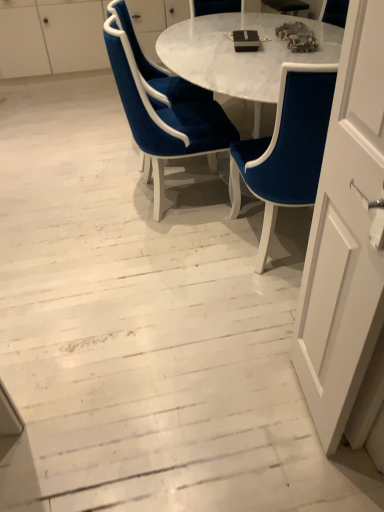
You are a GUI agent. You are given a task and a screenshot of the screen. Output one action in this format:
    pyautogui.click(x=<x>, y=<y>)
    Task: Click on the vacant space in between velvet blue chair at center, the 3th chair from the left, and velvet blue chair at center, acting as the 2th chair starting from the right
    Image resolution: width=384 pixels, height=512 pixels.
    Given the screenshot: What is the action you would take?
    pyautogui.click(x=198, y=231)